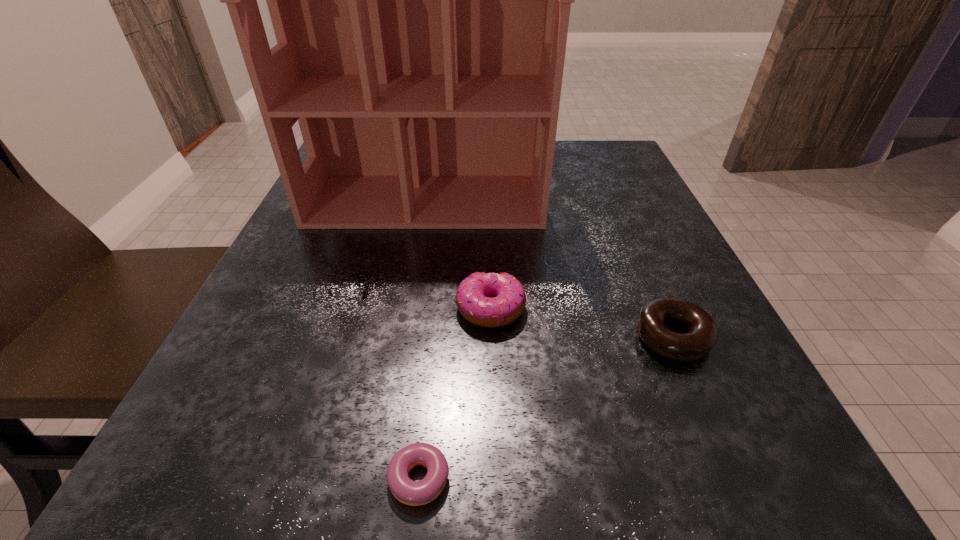
The width and height of the screenshot is (960, 540). Find the location of `vacant space positioned 0.090m on the back of the nearest doughnut`. vacant space positioned 0.090m on the back of the nearest doughnut is located at coordinates (423, 383).

You are a GUI agent. You are given a task and a screenshot of the screen. Output one action in this format:
    pyautogui.click(x=<x>, y=<y>)
    Task: Click on the object present at the far edge
    Image resolution: width=960 pixels, height=540 pixels.
    Given the screenshot: What is the action you would take?
    pyautogui.click(x=420, y=0)

Find the location of `object that is positioned at the near edge`. object that is positioned at the near edge is located at coordinates (409, 492).

This screenshot has height=540, width=960. Find the location of `object present at the left edge`. object present at the left edge is located at coordinates (420, 0).

Identify the location of object located at the right edge. The width and height of the screenshot is (960, 540). (702, 333).

Locate an element on the screen. object that is at the far left corner is located at coordinates (420, 0).

The width and height of the screenshot is (960, 540). I want to click on free space at the near edge of the desktop, so click(x=463, y=444).

This screenshot has height=540, width=960. In the image, there is a desktop. Find the location of `vacant space at the left edge`. vacant space at the left edge is located at coordinates (370, 231).

Where is `vacant region at the right edge of the desktop`? vacant region at the right edge of the desktop is located at coordinates [577, 215].

This screenshot has height=540, width=960. Identify the location of vacant space at the near left corner of the desktop. (158, 497).